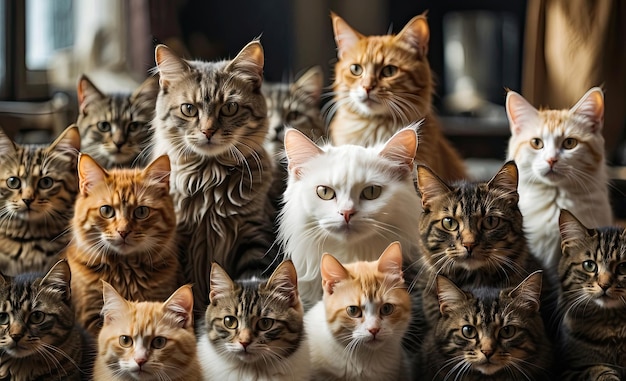
Find the location of `white fur`. white fur is located at coordinates (300, 233), (329, 343), (213, 369), (131, 363), (546, 209), (359, 96), (141, 244), (34, 214), (120, 157).